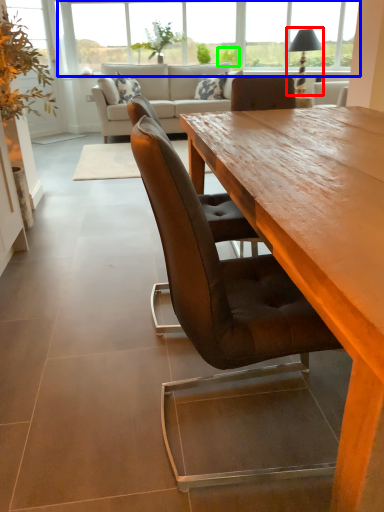
Question: Based on their relative distances, which object is farther from lamp (highlighted by a red box)? Choose from window (highlighted by a blue box) and plant (highlighted by a green box).

Choices:
 (A) window
 (B) plant

Answer: (A)